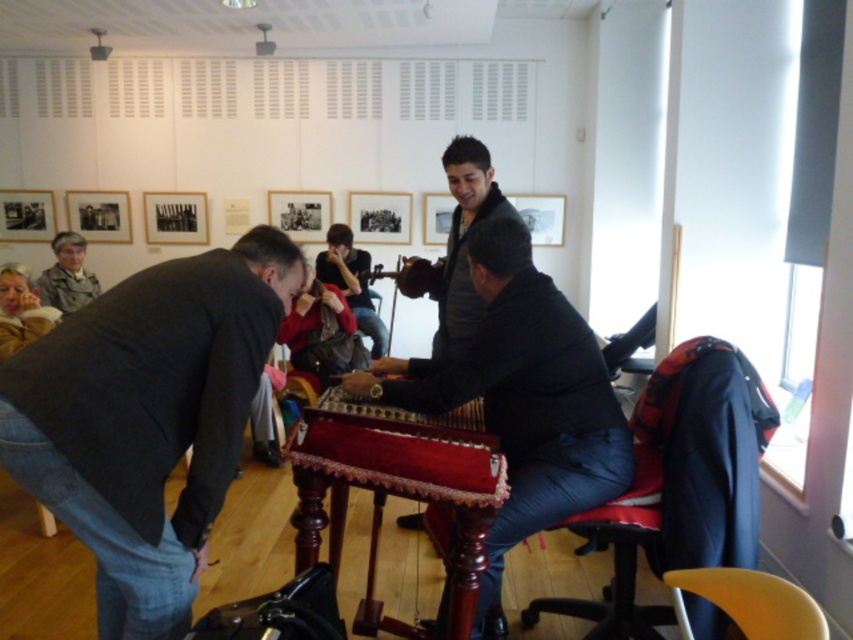
Does point (341, 244) come behind point (426, 280)?

Yes, point (341, 244) is behind point (426, 280).

Between point (386, 336) and point (416, 289), which one is positioned behind?

The point (386, 336) is behind.

Describe the element at coordinates (352, 282) in the screenshot. I see `red velvet guitar at center` at that location.

Identify the location of red velvet guitar at center. The image size is (853, 640). (352, 282).

Is dark blue fabric jacket at center further to camera compared to yellow plastic chair at lower right?

That is True.

Who is more forward, (x=521, y=328) or (x=737, y=614)?

Point (x=737, y=614)

The image size is (853, 640). I want to click on dark blue fabric jacket at center, so click(521, 397).

How much distance is there between dark gray sweater at lower left and wooden acoustic guitar at center?

dark gray sweater at lower left is 5.00 feet from wooden acoustic guitar at center.

Does point (120, 353) lie in front of point (397, 285)?

Yes.

Is point (149, 278) in front of point (440, 289)?

Yes, it is in front of point (440, 289).

Find the location of a particular element. dark gray sweater at lower left is located at coordinates (148, 419).